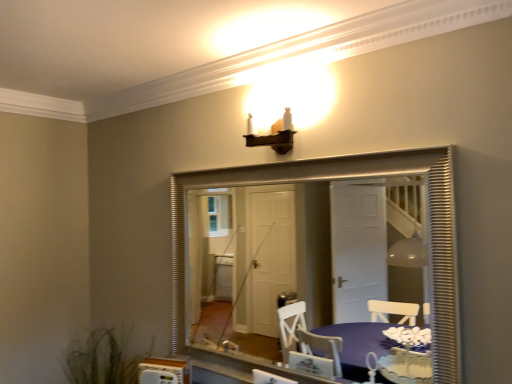
Question: Can you confirm if silver textured mirror at center is wider than green grass at lower left?

Choices:
 (A) no
 (B) yes

Answer: (A)

Question: Does silver textured mirror at center lie behind green grass at lower left?

Choices:
 (A) no
 (B) yes

Answer: (A)

Question: Is silver textured mirror at center facing away from green grass at lower left?

Choices:
 (A) yes
 (B) no

Answer: (B)

Question: Does silver textured mirror at center have a lesser width compared to green grass at lower left?

Choices:
 (A) yes
 (B) no

Answer: (A)

Question: Is silver textured mirror at center in front of green grass at lower left?

Choices:
 (A) yes
 (B) no

Answer: (A)

Question: From the image's perspective, is purple fabric table at lower center located above or below silver textured mirror at center?

Choices:
 (A) below
 (B) above

Answer: (A)

Question: Based on their positions, is purple fabric table at lower center located to the left or right of silver textured mirror at center?

Choices:
 (A) right
 (B) left

Answer: (A)

Question: From a real-world perspective, is purple fabric table at lower center physically located above or below silver textured mirror at center?

Choices:
 (A) below
 (B) above

Answer: (A)

Question: Relative to silver textured mirror at center, is purple fabric table at lower center in front or behind?

Choices:
 (A) front
 (B) behind

Answer: (A)

Question: In terms of size, does purple fabric table at lower center appear bigger or smaller than green grass at lower left?

Choices:
 (A) small
 (B) big

Answer: (A)

Question: Is purple fabric table at lower center in front of or behind green grass at lower left in the image?

Choices:
 (A) behind
 (B) front

Answer: (B)

Question: In the image, is purple fabric table at lower center on the left side or the right side of green grass at lower left?

Choices:
 (A) right
 (B) left

Answer: (A)

Question: Is purple fabric table at lower center taller or shorter than green grass at lower left?

Choices:
 (A) tall
 (B) short

Answer: (B)

Question: From a real-world perspective, is green grass at lower left above or below purple fabric table at lower center?

Choices:
 (A) below
 (B) above

Answer: (A)

Question: Is point (88, 360) closer or farther from the camera than point (375, 350)?

Choices:
 (A) closer
 (B) farther

Answer: (A)